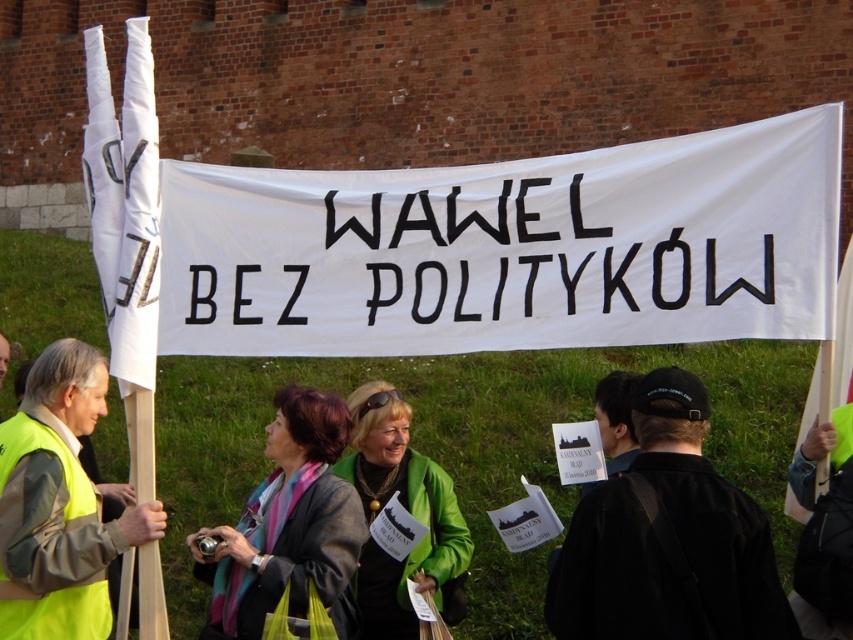
You are a photographer positioned at the origin point of the image coordinate system. You want to capture a closeup shot of the neon yellow vest at center. What are the coordinates where you should aim your camera?

The neon yellow vest at center is located at point coordinates of (59, 504). Therefore, you should aim your camera at those coordinates to capture the closeup shot.

You are a photographer trying to capture a clear shot of both the gray woolen jacket at center and the white paper flag at center. Since you can only focus on one object at a time, which one should you focus on first to ensure the other is still in the frame?

The gray woolen jacket at center is to the left of the white paper flag at center. Since the photographer can focus on one object at a time, focusing on the gray woolen jacket at center first ensures the white paper flag at center remains in the frame to its right.

You are a photographer at the event and want to capture both the neon yellow vest at center and the green leather jacket at center in a single photo. Which object should you focus on first to ensure both are in sharp focus?

You should focus on the neon yellow vest at center first since it is closer to the viewer than the green leather jacket at center. By focusing on the closer object, the depth of field may include both in sharp focus.